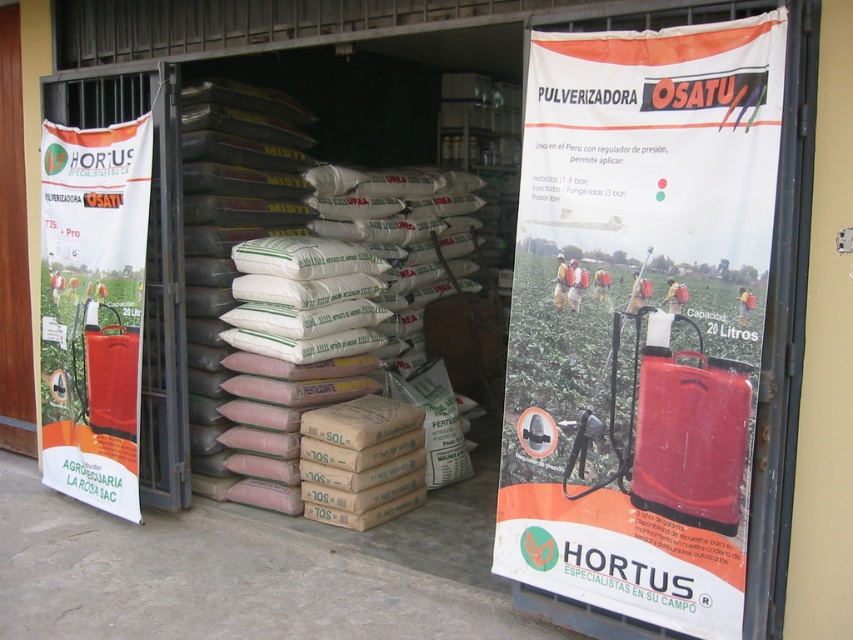
Does orange plastic poster at right have a greater height compared to white paper poster at left?

Indeed, orange plastic poster at right has a greater height compared to white paper poster at left.

The height and width of the screenshot is (640, 853). Find the location of `orange plastic poster at right`. orange plastic poster at right is located at coordinates (640, 323).

Where is `orange plastic poster at right`? orange plastic poster at right is located at coordinates (640, 323).